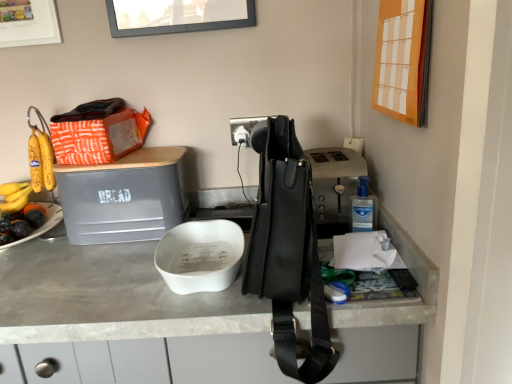
Question: Is point (279, 286) closer or farther from the camera than point (401, 117)?

Choices:
 (A) closer
 (B) farther

Answer: (A)

Question: In terms of size, does black leather handbag at center appear bigger or smaller than orange paper calendar at upper right, positioned as the second picture frame in left-to-right order?

Choices:
 (A) small
 (B) big

Answer: (B)

Question: Estimate the real-world distances between objects in this image. Which object is closer to the gray matte bread bin at upper left?

Choices:
 (A) white matte bowl at center
 (B) black plastic power outlet at center
 (C) matte white picture frame at upper left, the 2th picture frame when ordered from right to left
 (D) black leather handbag at center
 (E) orange paper calendar at upper right, which ranks as the first picture frame in right-to-left order

Answer: (A)

Question: Estimate the real-world distances between objects in this image. Which object is closer to the black leather handbag at center?

Choices:
 (A) black plastic power outlet at center
 (B) white matte bowl at center
 (C) gray matte bread bin at upper left
 (D) matte white picture frame at upper left, the first picture frame in the left-to-right sequence
 (E) orange paper calendar at upper right, which appears as the 1th picture frame when viewed from the front

Answer: (B)